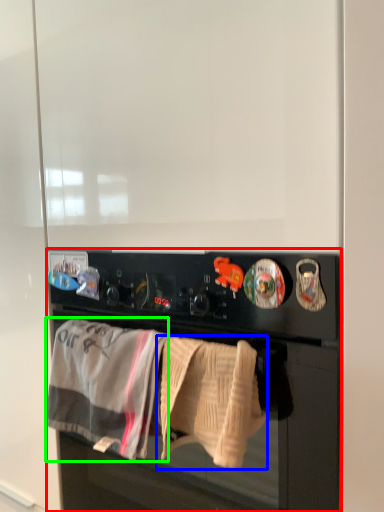
Question: Based on their relative distances, which object is farther from home appliance (highlighted by a red box)? Choose from bath towel (highlighted by a blue box) and bath towel (highlighted by a green box).

Choices:
 (A) bath towel
 (B) bath towel

Answer: (B)